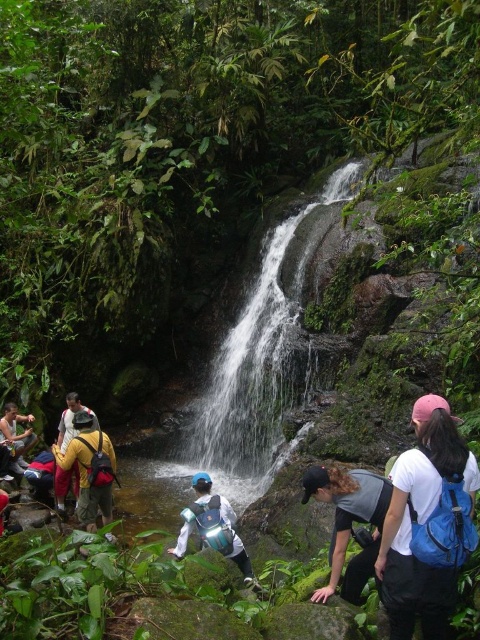
You are a hiker who wants to retrieve your yellow backpack at lower left. You are currently standing next to the yellow backpack at left. Which direction should you move to reach your backpack?

The yellow backpack at lower left is below the yellow backpack at left, so you should move downward to reach it.

You are a hiker who wants to place your yellow backpack at left safely near the white smooth waterfall at center. Based on their positions, can you leave the backpack there without it getting wet?

The white smooth waterfall at center is located above the yellow backpack at left, so water from the waterfall could potentially reach the backpack. It is advisable to move the backpack to a higher or drier location to prevent it from getting wet.

You are a photographer trying to capture a clear shot of the dark gray fabric cap at center and the green mossy rock at center in the jungle scene. Considering their sizes, which object should you focus on first to ensure both are in frame without needing to adjust the camera angle?

The dark gray fabric cap at center is larger than the green mossy rock at center, so you should focus on the dark gray fabric cap at center first to ensure it fits within the frame before adjusting for the smaller rock.